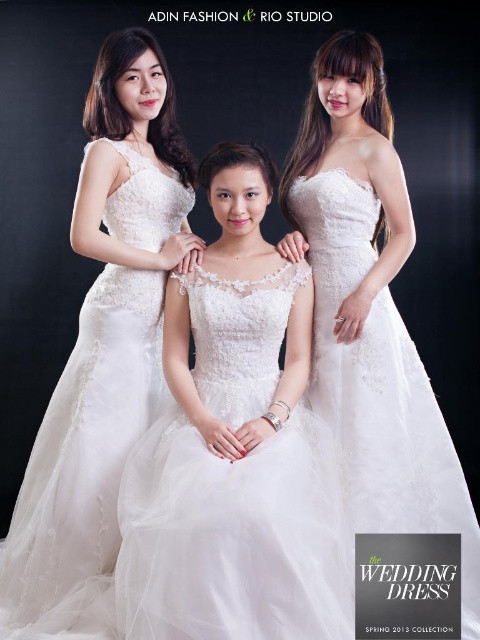
Between white lace dress at center and lace fabric wedding dress at center, which one is positioned higher?

lace fabric wedding dress at center is higher up.

Between point (236, 307) and point (80, 333), which one is positioned behind?

The point (80, 333) is behind.

Identify the location of white lace dress at center. This screenshot has height=640, width=480. (235, 449).

Can you confirm if white lace dress at center is shorter than white lace dress at upper right?

Indeed, white lace dress at center has a lesser height compared to white lace dress at upper right.

Does white lace dress at center have a lesser width compared to white lace dress at upper right?

In fact, white lace dress at center might be wider than white lace dress at upper right.

Locate an element on the screen. white lace dress at center is located at coordinates 235,449.

Can you confirm if lace fabric wedding dress at center is positioned above white lace dress at upper right?

Yes, lace fabric wedding dress at center is above white lace dress at upper right.

Which of these two, lace fabric wedding dress at center or white lace dress at upper right, stands shorter?

lace fabric wedding dress at center

Between point (147, 60) and point (422, 465), which one is positioned behind?

Point (147, 60)

Locate an element on the screen. lace fabric wedding dress at center is located at coordinates (104, 333).